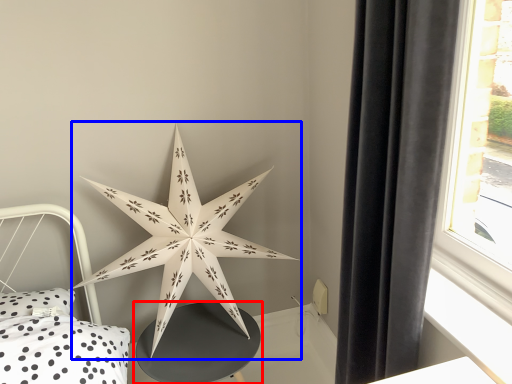
Question: Among these objects, which one is nearest to the camera, table (highlighted by a red box) or star (highlighted by a blue box)?

Choices:
 (A) table
 (B) star

Answer: (B)